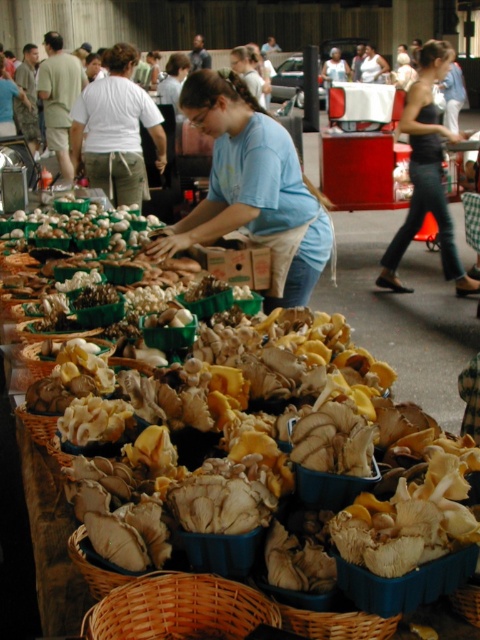
You are a customer at the market and want to pick up the woven brown basket at lower center. Which side of the blue cotton shirt at center should you approach from?

The blue cotton shirt at center is positioned on the right side of woven brown basket at lower center, so you should approach from the left side of the blue cotton shirt at center to reach the woven brown basket at lower center.

You are a customer at the market and want to buy both the black denim jeans at lower right and the matte blue shirt at center. However, you have a small bag that can only carry items narrower than the shirt. Which item should you prioritize purchasing first?

The black denim jeans at lower right is wider than the matte blue shirt at center, so you should prioritize purchasing the matte blue shirt at center first since it is narrower and fits in your bag.

You are a customer at the market and want to pick up the woven brown basket at lower center. However, there is a person in the way wearing the matte blue shirt at center. Can you reach the basket without moving the person?

The woven brown basket at lower center is below the matte blue shirt at center, so the basket is positioned lower than the person. This means you can likely reach it without needing to move the person, as the basket is below their standing position.